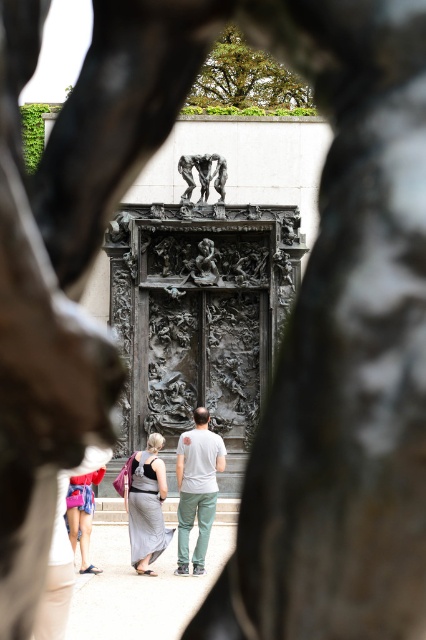
You are standing in front of the monument and notice two people wearing different outfits. The person in the matte gray dress at center is walking towards the monument, while the other in denim shorts at lower left is walking away. Can you determine which outfit is closer to you?

The matte gray dress at center is closer to the viewer than denim shorts at lower left, so the matte gray dress at center is closer to you.

You are a photographer trying to capture a photo of the matte gray dress at center and denim shorts at lower left. Since you want to ensure both are in focus, you need to know their heights. Which one is taller?

The matte gray dress at center is much taller as denim shorts at lower left, so the matte gray dress at center is taller.

From the picture: You are standing in front of the monument and see a person wearing a matte gray dress at center and another wearing denim shorts at lower left. Which clothing item is positioned higher in the scene?

The matte gray dress at center is located above denim shorts at lower left, so the matte gray dress at center is positioned higher in the scene.